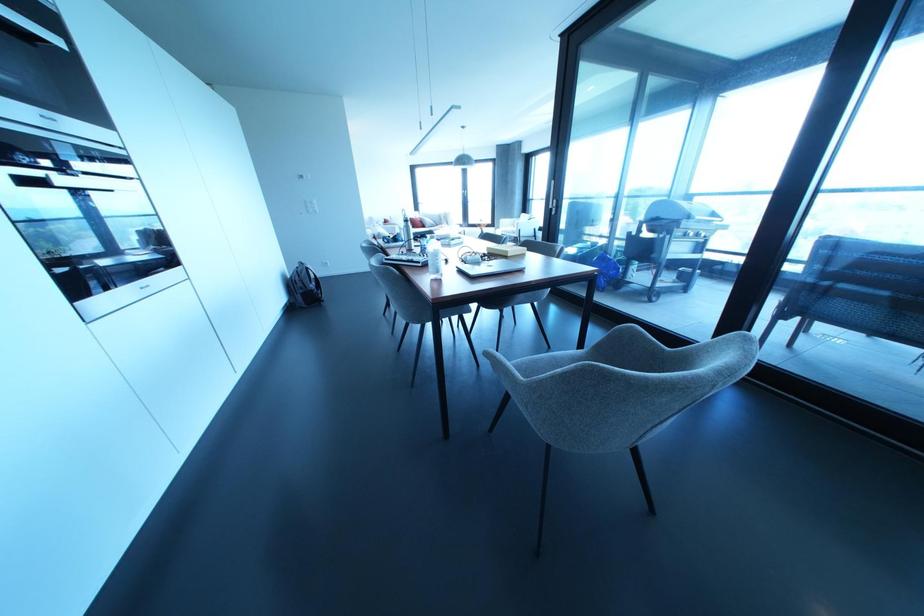
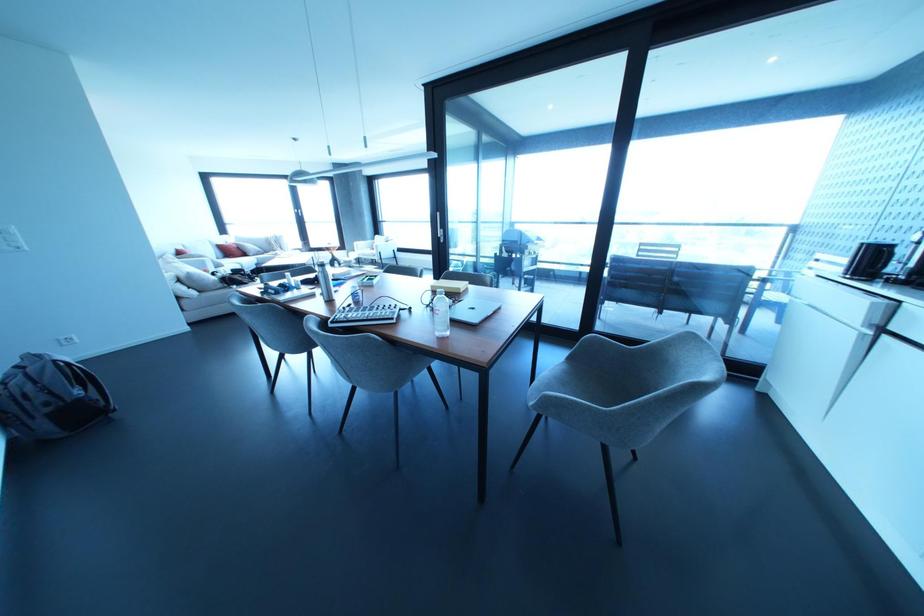
Question: The first image is from the beginning of the video and the second image is from the end. How did the camera likely rotate when shooting the video?

Choices:
 (A) Left
 (B) Right
 (C) Up
 (D) Down

Answer: (B)